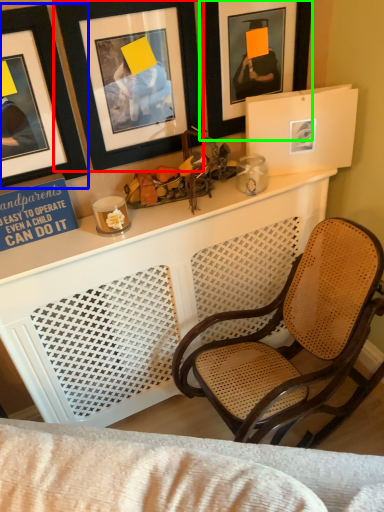
Question: Based on their relative distances, which object is farther from picture frame (highlighted by a red box)? Choose from picture frame (highlighted by a blue box) and picture frame (highlighted by a green box).

Choices:
 (A) picture frame
 (B) picture frame

Answer: (B)